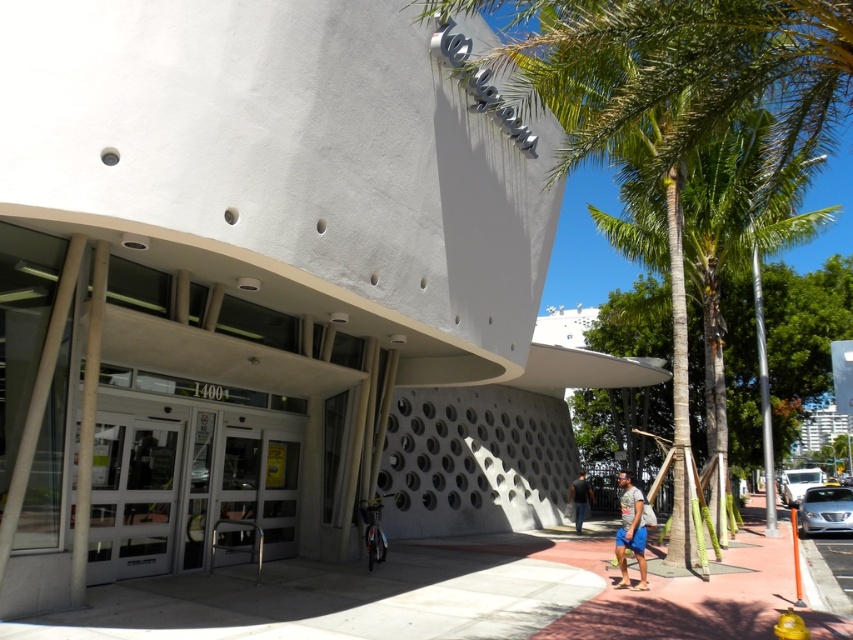
Which is behind, point (639, 248) or point (576, 484)?

The point (639, 248) is more distant.

Is green textured palm tree at right below dark gray shirt at center?

No, green textured palm tree at right is not below dark gray shirt at center.

Measure the distance between point (x=717, y=230) and camera.

A distance of 15.40 meters exists between point (x=717, y=230) and camera.

The width and height of the screenshot is (853, 640). Find the location of `green textured palm tree at right`. green textured palm tree at right is located at coordinates (735, 230).

Is the position of white glossy car at right more distant than that of dark gray shirt at center?

Yes, it is behind dark gray shirt at center.

Can you confirm if white glossy car at right is wider than dark gray shirt at center?

Correct, the width of white glossy car at right exceeds that of dark gray shirt at center.

Which is behind, point (788, 481) or point (585, 483)?

Point (788, 481)

Identify the location of white glossy car at right. (798, 483).

Is concrete sidewalk at center below silver metallic sedan at lower right?

No, concrete sidewalk at center is not below silver metallic sedan at lower right.

Is concrete sidewalk at center taller than silver metallic sedan at lower right?

Yes, concrete sidewalk at center is taller than silver metallic sedan at lower right.

Is point (265, 634) in front of point (824, 529)?

Yes, point (265, 634) is closer to viewer.

Locate an element on the screen. This screenshot has width=853, height=640. concrete sidewalk at center is located at coordinates (445, 595).